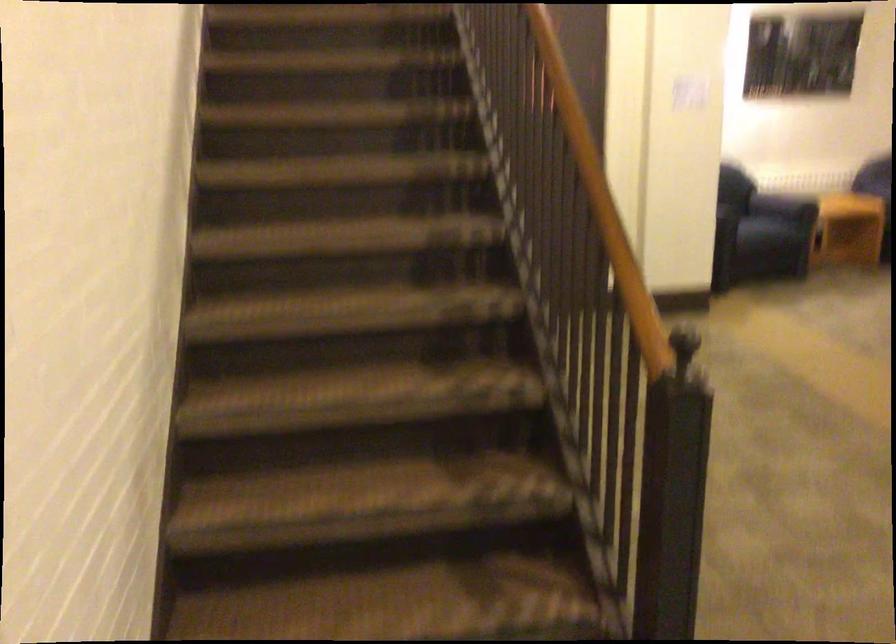
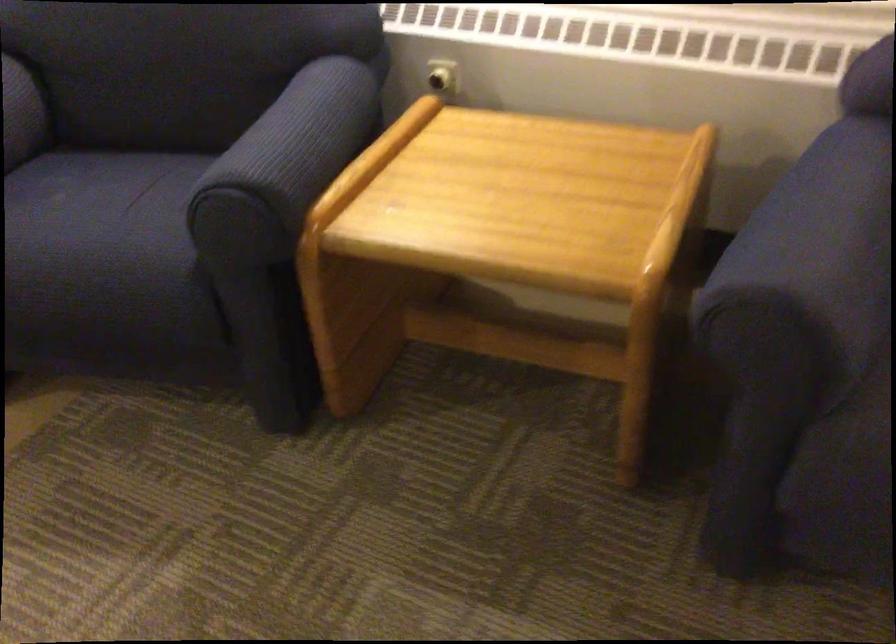
In the second image, find the point that corresponds to (787,214) in the first image.

(99, 232)